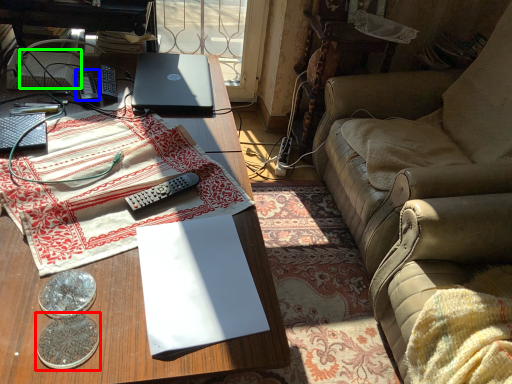
Question: Considering the real-world distances, which object is closest to coin (highlighted by a red box)? remote control (highlighted by a blue box) or paperback book (highlighted by a green box).

Choices:
 (A) remote control
 (B) paperback book

Answer: (A)